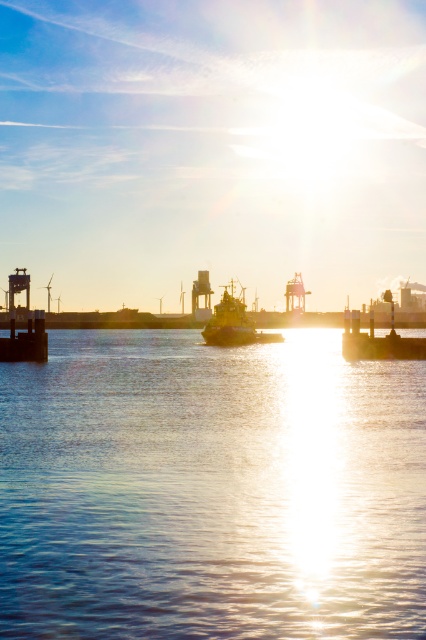
Question: Is glistening water at center closer to camera compared to shiny metallic tugboat at center?

Choices:
 (A) yes
 (B) no

Answer: (A)

Question: Is glistening water at center below shiny metallic tugboat at center?

Choices:
 (A) yes
 (B) no

Answer: (A)

Question: Is glistening water at center wider than shiny metallic tugboat at center?

Choices:
 (A) no
 (B) yes

Answer: (B)

Question: Which point appears farthest from the camera in this image?

Choices:
 (A) (229, 480)
 (B) (233, 298)

Answer: (B)

Question: Which point is farther to the camera?

Choices:
 (A) glistening water at center
 (B) shiny metallic tugboat at center

Answer: (B)